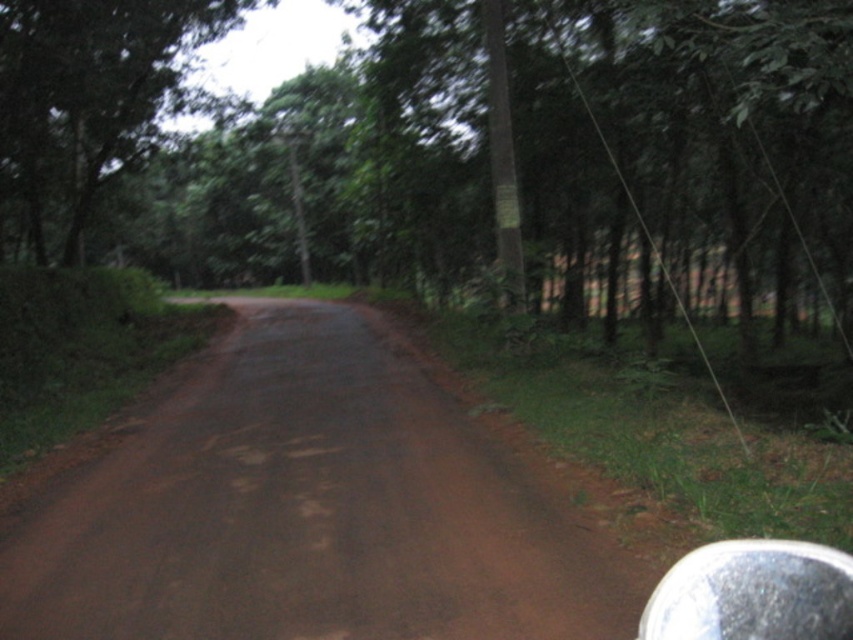
You are riding a motorcycle on the brown dirt track at center and see a point marked at coordinate (309, 509). Is this point located on the dirt track or off the track?

The point at (309, 509) is on the brown dirt track at center, so it is located on the track.

You are driving a car that is 2 meters wide. You come across a narrow section of the road where the brown dirt track at center and the green matte tree at right are present. Can your car safely pass through this section without hitting the tree?

The brown dirt track at center has a lesser width compared to the green matte tree at right. Since the car is 2 meters wide and the track is narrower than the tree, it might not be wide enough to safely pass through without risking collision with the tree. It is advisable to proceed with caution or look for an alternative route.

You are riding a motorcycle and see the green leafy tree at upper left in your rearview mirror. Can you estimate how far it is from you?

The green leafy tree at upper left is 15.38 meters away from the viewer.